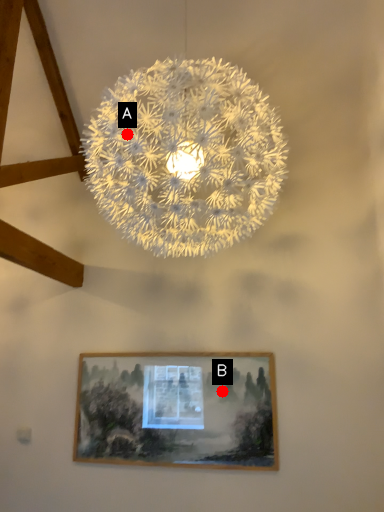
Question: Two points are circled on the image, labeled by A and B beside each circle. Among these points, which one is farthest from the camera?

Choices:
 (A) A is further
 (B) B is further

Answer: (B)